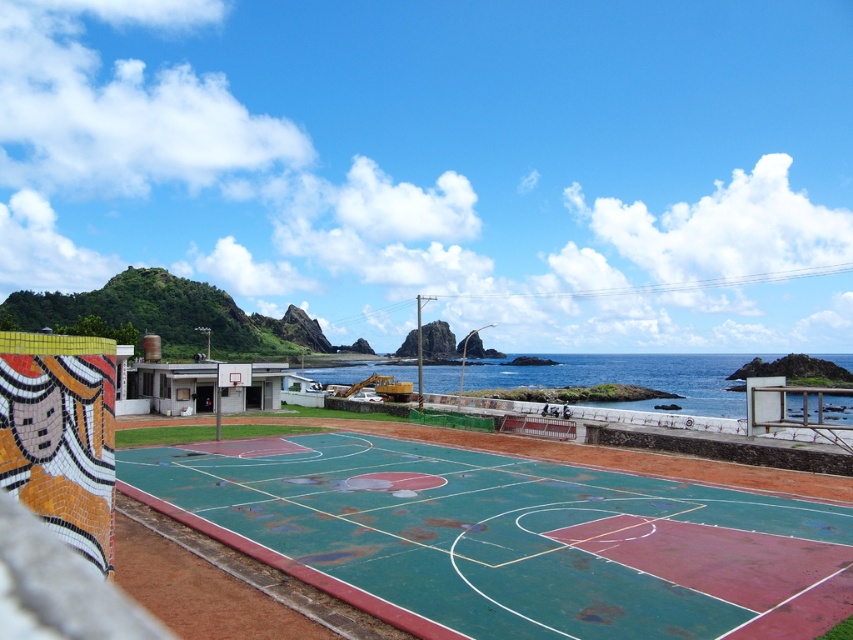
Question: Is green rubber basketball court at center thinner than metallic silver basketball hoop at center?

Choices:
 (A) yes
 (B) no

Answer: (B)

Question: Does blue water at center come in front of metallic silver basketball hoop at center?

Choices:
 (A) no
 (B) yes

Answer: (B)

Question: Which object is farther from the camera taking this photo?

Choices:
 (A) metallic silver basketball hoop at center
 (B) blue water at center
 (C) green rubber basketball court at center

Answer: (A)

Question: Is green rubber basketball court at center bigger than blue water at center?

Choices:
 (A) no
 (B) yes

Answer: (A)

Question: Which point is farther to the camera?

Choices:
 (A) (616, 548)
 (B) (241, 387)

Answer: (B)

Question: Among these objects, which one is nearest to the camera?

Choices:
 (A) green rubber basketball court at center
 (B) blue water at center
 (C) metallic silver basketball hoop at center

Answer: (A)